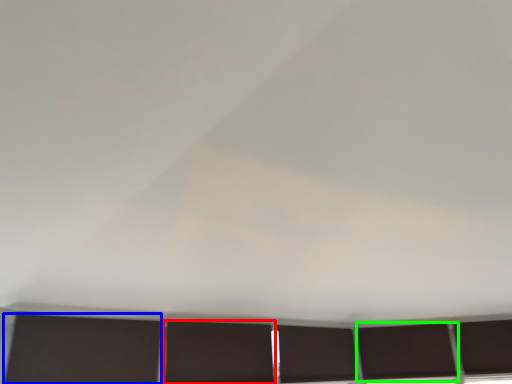
Question: Which is farther away from shutter (highlighted by a red box)? shutter (highlighted by a blue box) or window (highlighted by a green box)?

Choices:
 (A) shutter
 (B) window

Answer: (B)